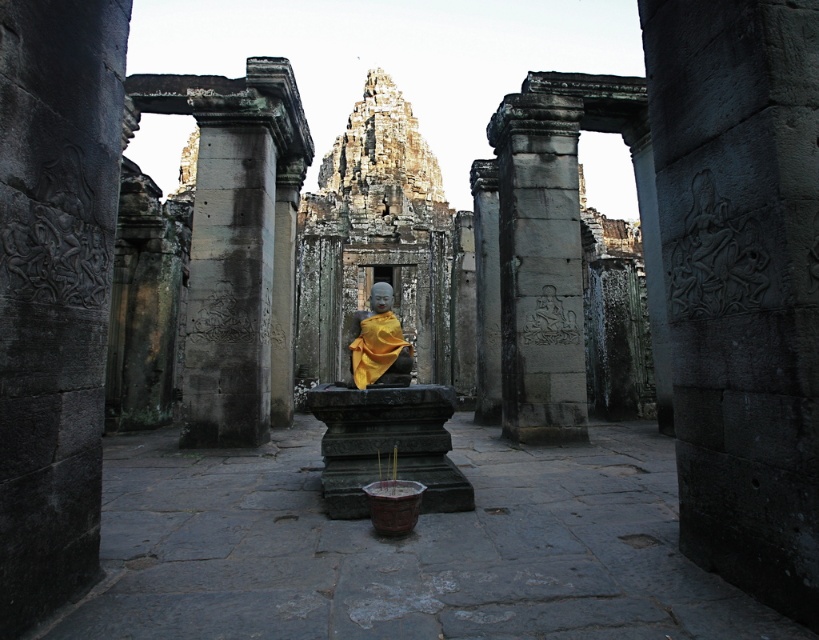
From the picture: Is carved stone relief at center further to camera compared to yellow fabric statue at center?

That is False.

What do you see at coordinates (741, 282) in the screenshot?
I see `carved stone relief at center` at bounding box center [741, 282].

Is point (727, 531) closer to camera compared to point (387, 300)?

Yes, it is.

The height and width of the screenshot is (640, 819). Identify the location of carved stone relief at center. (741, 282).

From the picture: Between carved stone relief at center and gray stone pillar at center, which one is positioned higher?

Positioned higher is gray stone pillar at center.

This screenshot has height=640, width=819. Find the location of `carved stone relief at center`. carved stone relief at center is located at coordinates (741, 282).

Between point (731, 108) and point (229, 353), which one is positioned behind?

The point (229, 353) is behind.

Image resolution: width=819 pixels, height=640 pixels. Find the location of `carved stone relief at center`. carved stone relief at center is located at coordinates (741, 282).

In the scene shown: Does carved stone relief at center have a smaller size compared to gray stone carving at center?

No.

In the scene shown: Is carved stone relief at center to the right of gray stone carving at center from the viewer's perspective?

Correct, you'll find carved stone relief at center to the right of gray stone carving at center.

Between point (743, 76) and point (555, 257), which one is positioned behind?

Point (555, 257)

The image size is (819, 640). I want to click on carved stone relief at center, so click(x=741, y=282).